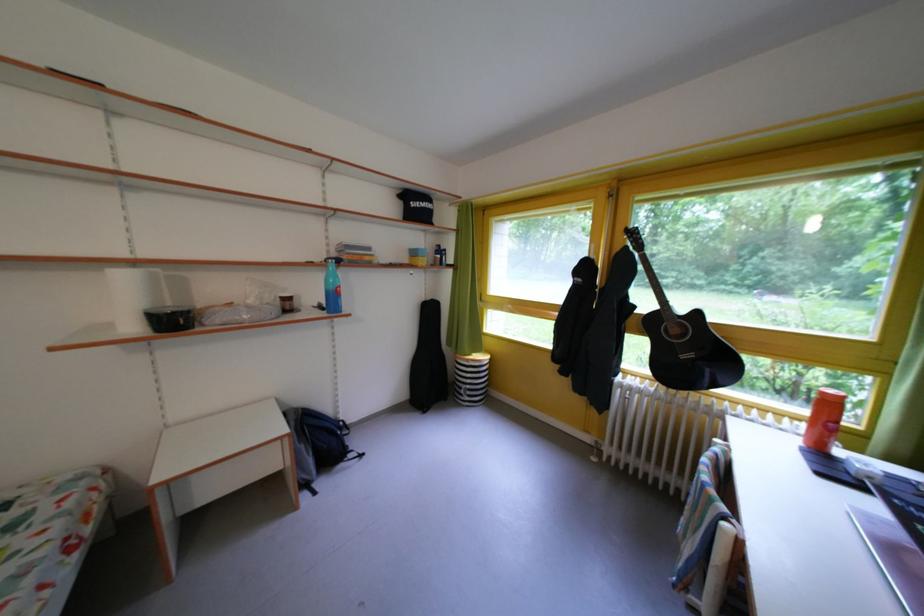
The location [286,302] corresponds to which object?

It refers to a small brown jar.